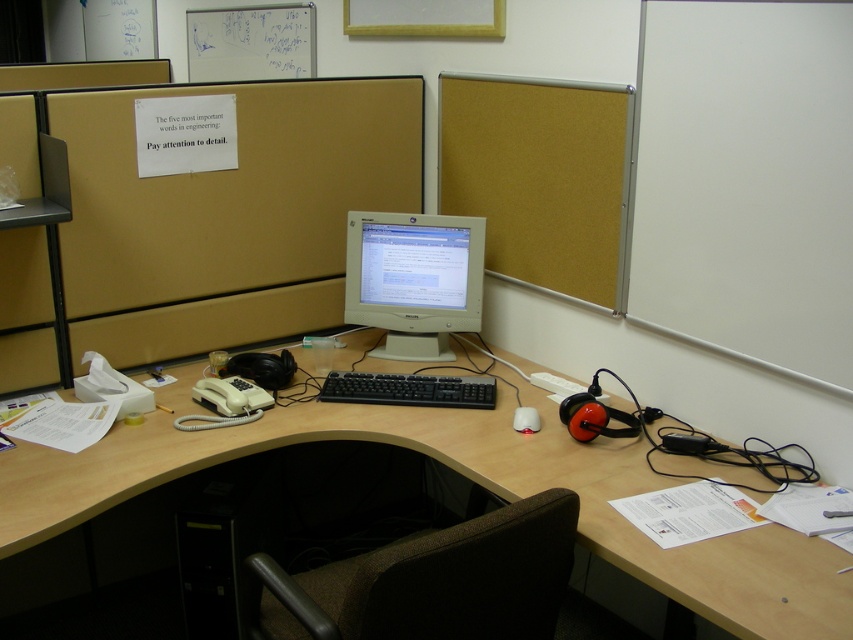
Is point (200, 445) behind point (355, 394)?

No, it is in front of (355, 394).

Can you confirm if wooden desk at center is positioned below black plastic keyboard at center?

Indeed, wooden desk at center is positioned under black plastic keyboard at center.

Locate an element on the screen. wooden desk at center is located at coordinates click(469, 477).

You are a GUI agent. You are given a task and a screenshot of the screen. Output one action in this format:
    pyautogui.click(x=<x>, y=<y>)
    Task: Click on the wooden desk at center
    
    Given the screenshot: What is the action you would take?
    pyautogui.click(x=469, y=477)

Which of these two, matte plastic monitor at center or white matte mouse at center, stands taller?

matte plastic monitor at center

Who is more distant from viewer, (372, 296) or (521, 417)?

The point (372, 296) is behind.

Which is behind, point (398, 244) or point (514, 412)?

Positioned behind is point (398, 244).

At what (x,y) coordinates should I click in order to perform the action: click on matte plastic monitor at center. Please return your answer as a coordinate pair (x, y). The image size is (853, 640). Looking at the image, I should click on (x=413, y=266).

Where is `brown fabric swivel chair at lower center`? Image resolution: width=853 pixels, height=640 pixels. brown fabric swivel chair at lower center is located at coordinates (432, 580).

Is point (548, 608) farther from viewer compared to point (401, 244)?

No, (548, 608) is in front of (401, 244).

Locate an element on the screen. brown fabric swivel chair at lower center is located at coordinates coord(432,580).